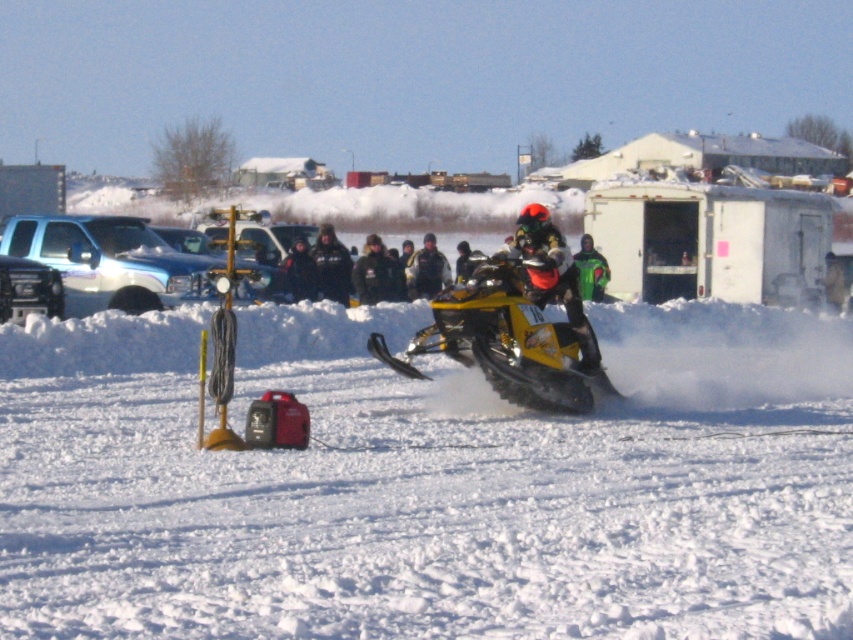
Can you confirm if yellow matte snowmobile at center is shorter than green matte jacket at center?

In fact, yellow matte snowmobile at center may be taller than green matte jacket at center.

Is yellow matte snowmobile at center wider than green matte jacket at center?

Yes.

This screenshot has width=853, height=640. Identify the location of yellow matte snowmobile at center. (503, 340).

Based on the photo, does white fluffy snow at center appear under black leather jacket at center?

Correct, white fluffy snow at center is located below black leather jacket at center.

In the scene shown: Is white fluffy snow at center above black leather jacket at center?

Incorrect, white fluffy snow at center is not positioned above black leather jacket at center.

Which is behind, point (42, 419) or point (328, 257)?

The point (328, 257) is more distant.

I want to click on white fluffy snow at center, so (x=428, y=483).

Which of these two, white fluffy snow at center or yellow matte snowmobile at center, stands shorter?

yellow matte snowmobile at center is shorter.

Between white fluffy snow at center and yellow matte snowmobile at center, which one is positioned higher?

Positioned higher is yellow matte snowmobile at center.

Does point (622, 323) lie behind point (462, 321)?

Yes, point (622, 323) is farther from viewer.

You are a GUI agent. You are given a task and a screenshot of the screen. Output one action in this format:
    pyautogui.click(x=<x>, y=<y>)
    Task: Click on the white fluffy snow at center
    This screenshot has height=640, width=853.
    Given the screenshot: What is the action you would take?
    pyautogui.click(x=428, y=483)